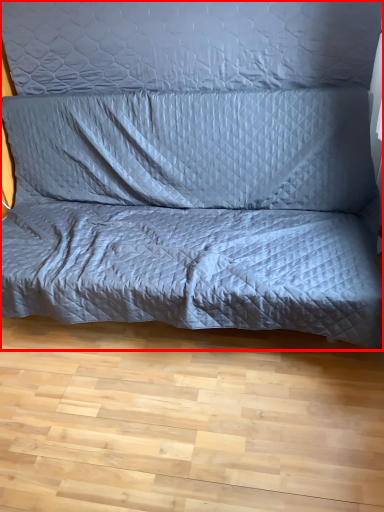
Question: Observing the image, what is the correct spatial positioning of studio couch (annotated by the red box) in reference to pillow?

Choices:
 (A) right
 (B) left

Answer: (B)